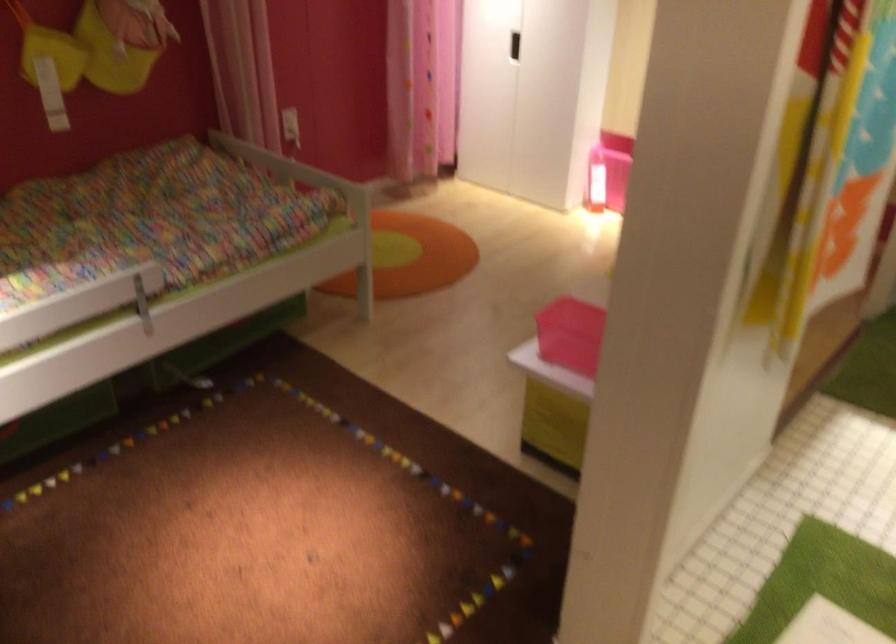
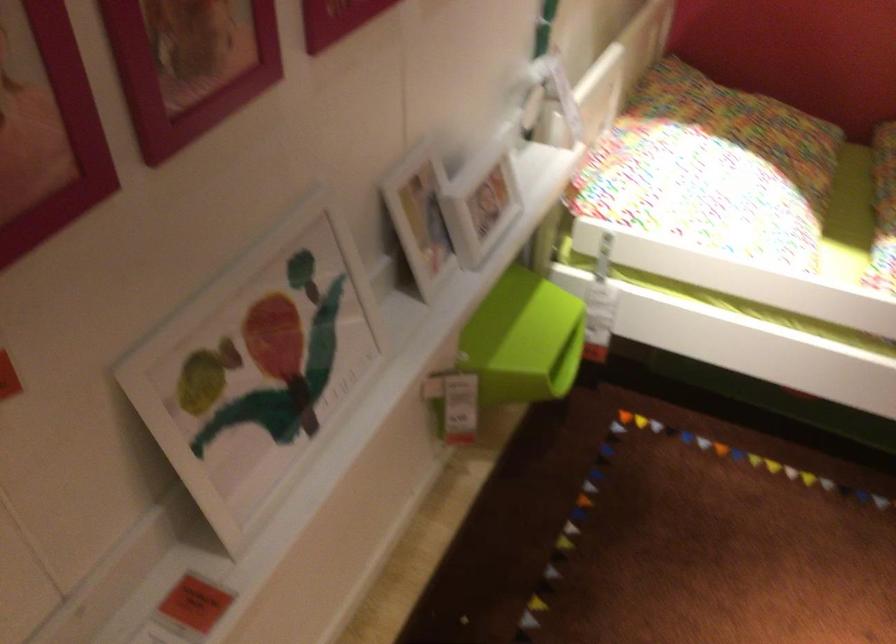
First-person continuous shooting, in which direction is the camera rotating?

The rotation direction of the camera is left-down.